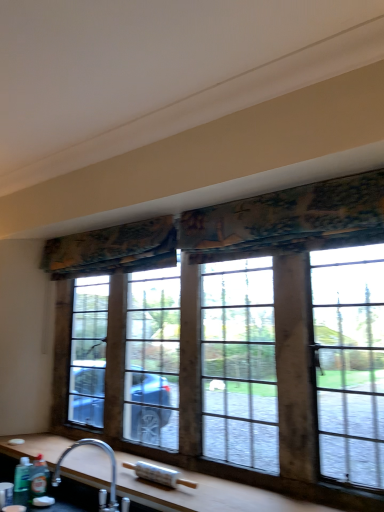
Question: Considering the positions of point (16, 464) and point (124, 500), is point (16, 464) closer or farther from the camera than point (124, 500)?

Choices:
 (A) closer
 (B) farther

Answer: (B)

Question: Visually, is translucent plastic bottle at lower left, marked as the 2th bottle in a right-to-left arrangement, positioned to the left or to the right of silver metallic faucet at lower left?

Choices:
 (A) right
 (B) left

Answer: (B)

Question: Which is farther from the textured floral fabric at upper center, placed as the second curtain when sorted from left to right?

Choices:
 (A) silver metallic faucet at lower left
 (B) green matte bottle at lower left, the second bottle from the left
 (C) textured fabric curtain at upper center, which appears as the second curtain when viewed from the right
 (D) wooden-framed window at center
 (E) wooden at lower center

Answer: (B)

Question: Considering the real-world distances, which object is closest to the wooden-framed window at center?

Choices:
 (A) green matte bottle at lower left, the 1th bottle positioned from the right
 (B) silver metallic faucet at lower left
 (C) translucent plastic bottle at lower left, marked as the 2th bottle in a right-to-left arrangement
 (D) textured floral fabric at upper center, placed as the first curtain when sorted from front to back
 (E) wooden at lower center

Answer: (D)